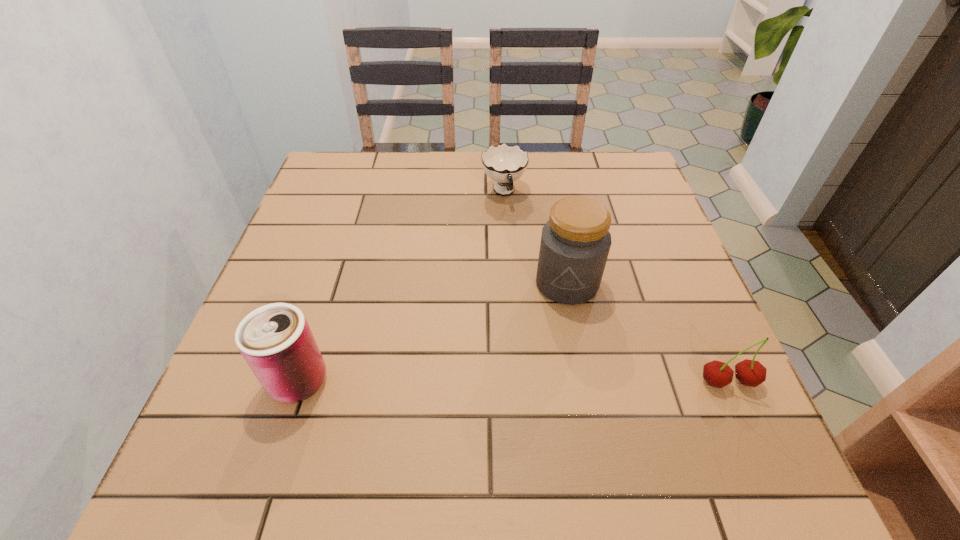
Locate an element on the screen. This screenshot has height=540, width=960. object that is at the near left corner is located at coordinates (275, 340).

You are a GUI agent. You are given a task and a screenshot of the screen. Output one action in this format:
    pyautogui.click(x=<x>, y=<y>)
    Task: Click on the object located in the near right corner section of the desktop
    Image resolution: width=960 pixels, height=540 pixels.
    Given the screenshot: What is the action you would take?
    pyautogui.click(x=752, y=373)

Identify the location of vacant region at the far edge. Image resolution: width=960 pixels, height=540 pixels. (383, 160).

I want to click on vacant region at the near edge of the desktop, so (584, 406).

Locate an element on the screen. blank space at the left edge is located at coordinates pyautogui.click(x=339, y=294).

Identify the location of free space at the right edge of the desktop. (701, 348).

In order to click on free point at the far left corner in this screenshot , I will do `click(351, 176)`.

The width and height of the screenshot is (960, 540). Find the location of `free space at the far right corner`. free space at the far right corner is located at coordinates (593, 179).

At what (x,y) coordinates should I click in order to perform the action: click on vacant region between the jar and the can. Please return your answer as a coordinate pair (x, y). Image resolution: width=960 pixels, height=540 pixels. Looking at the image, I should click on (433, 332).

I want to click on vacant region between the rightmost object and the cup, so click(x=616, y=287).